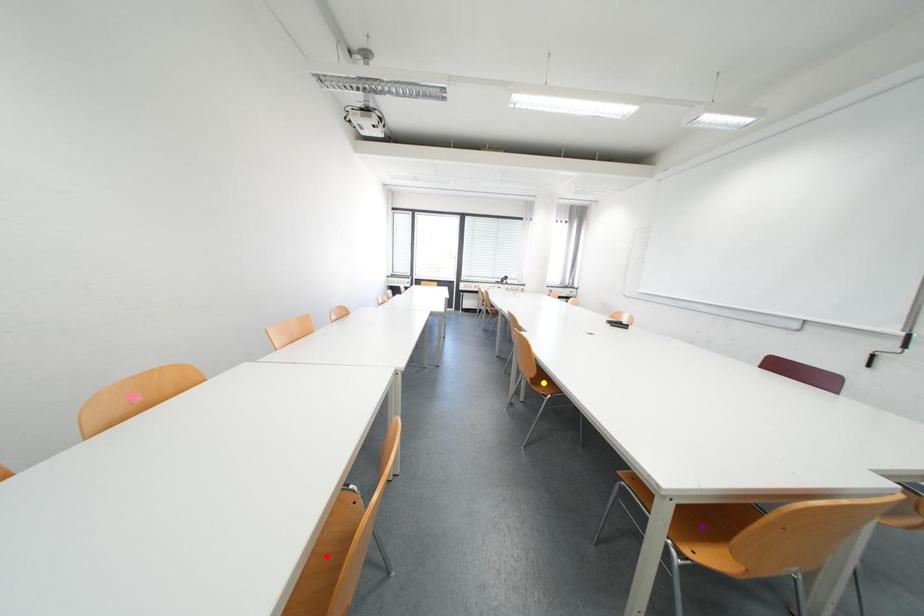
Consider the image. Order these from nearest to farthest:
yellow point | purple point | red point

purple point, red point, yellow point